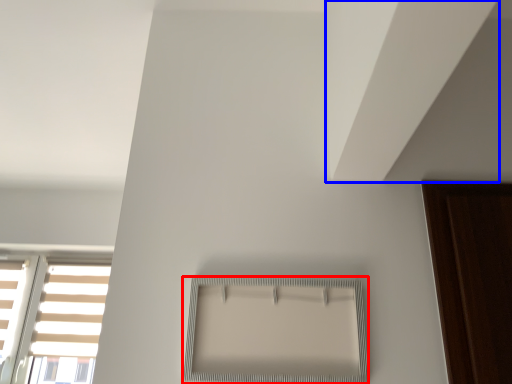
Question: Which of the following is the farthest to the observer, window (highlighted by a red box) or blind (highlighted by a blue box)?

Choices:
 (A) window
 (B) blind

Answer: (A)